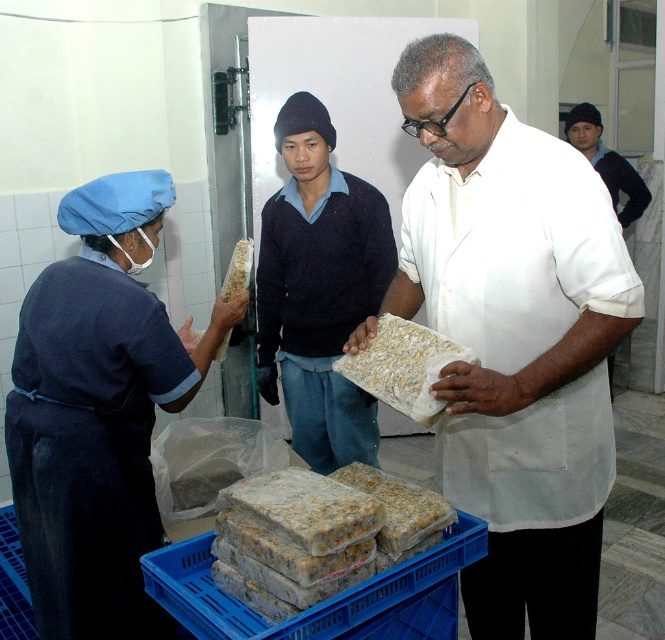
You are a quality inspector standing 5 feet away from the white matte rectangular object at center. Can you reach it without moving your current position?

The white matte rectangular object at center is 4.53 feet away from the camera, so yes, you can reach it without moving since you are only 0.47 feet away from your current position.